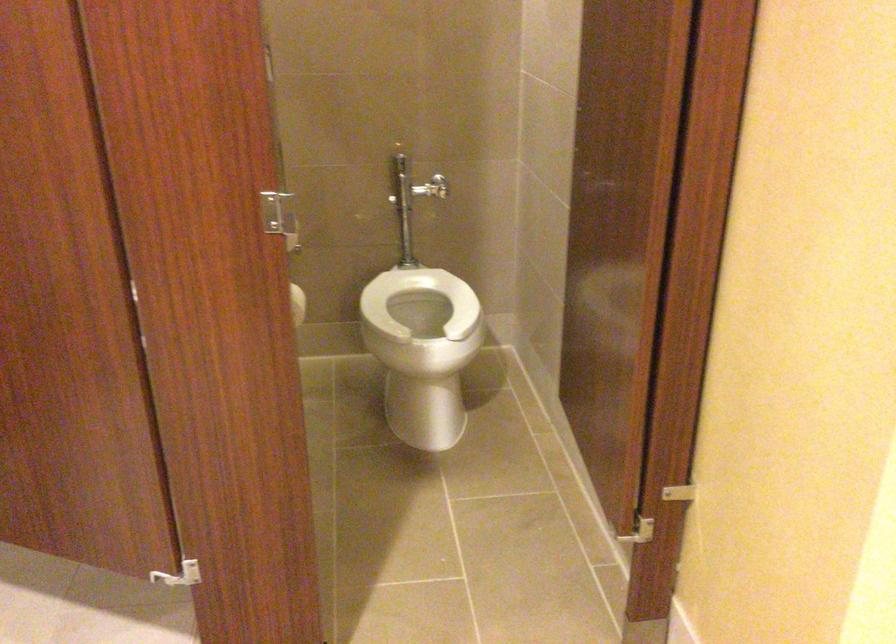
At what (x,y) coordinates should I click in order to perform the action: click on stall door lock. Please return your answer as a coordinate pair (x, y). The image size is (896, 644). Looking at the image, I should click on (279, 216).